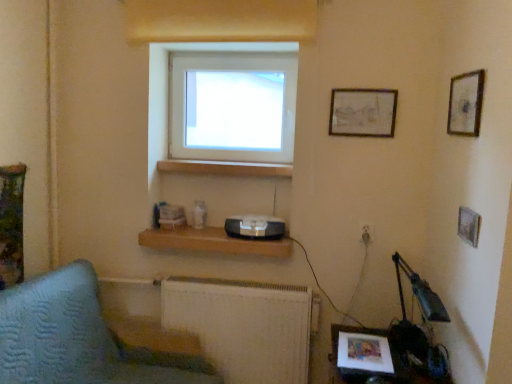
This screenshot has height=384, width=512. I want to click on blank space situated above wooden at center (from a real-world perspective), so click(217, 162).